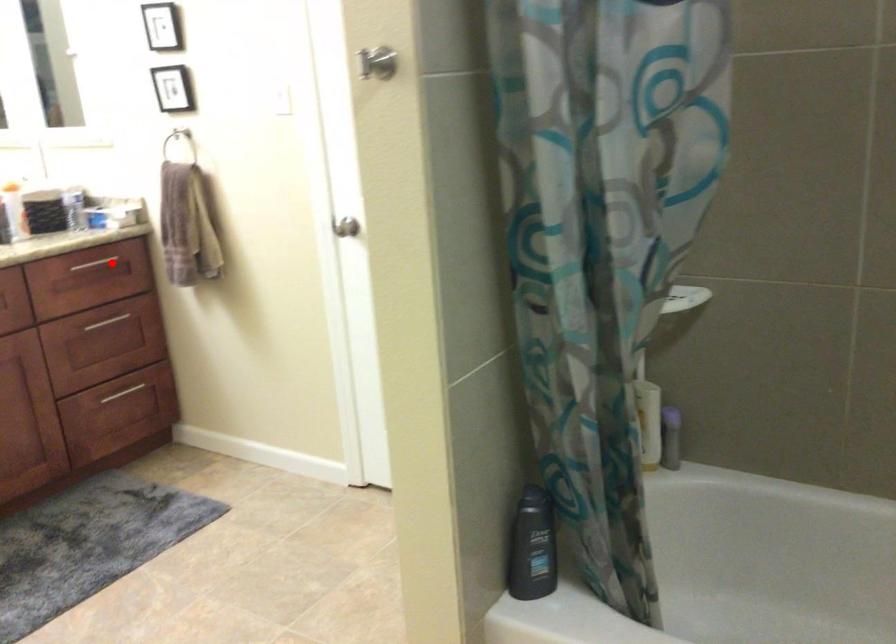
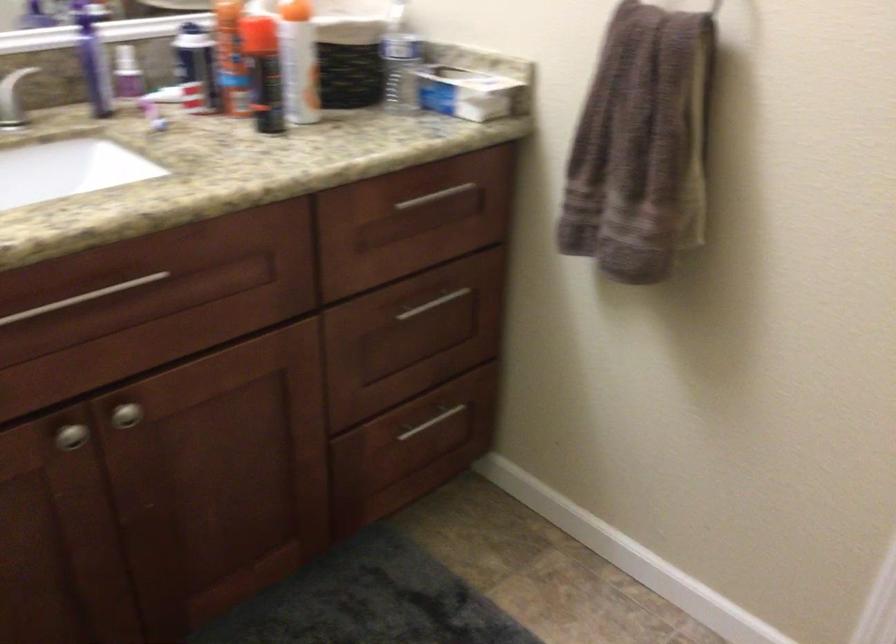
Question: I am providing you with two images of the same scene from different viewpoints. A red point is shown in image1. For the corresponding object point in image2, is it positioned nearer or farther from the camera?

Choices:
 (A) Nearer
 (B) Farther

Answer: (A)